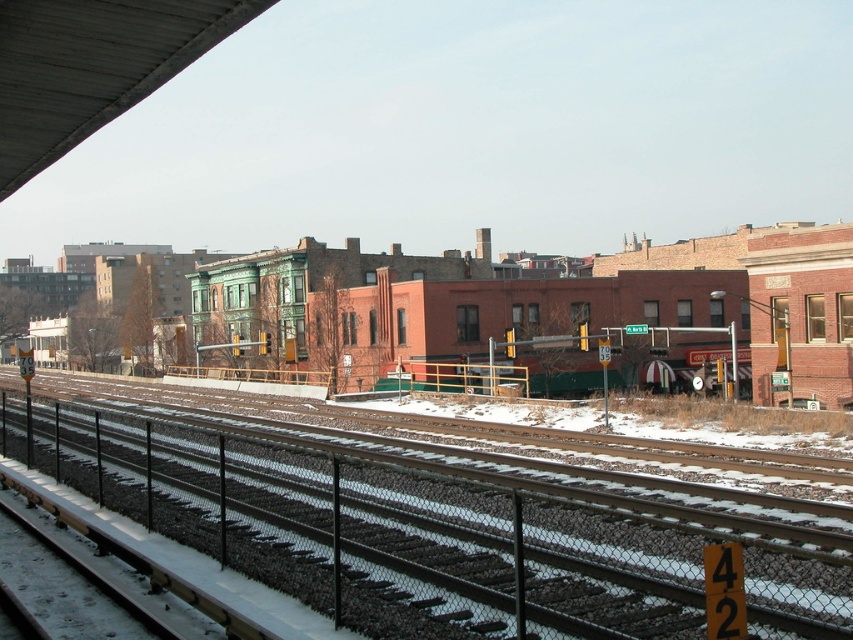
Is smooth asphalt tracks at center below metallic gray overpass at upper left?

Indeed, smooth asphalt tracks at center is positioned under metallic gray overpass at upper left.

Does smooth asphalt tracks at center appear over metallic gray overpass at upper left?

No, smooth asphalt tracks at center is not above metallic gray overpass at upper left.

Where is `smooth asphalt tracks at center`? smooth asphalt tracks at center is located at coordinates (444, 529).